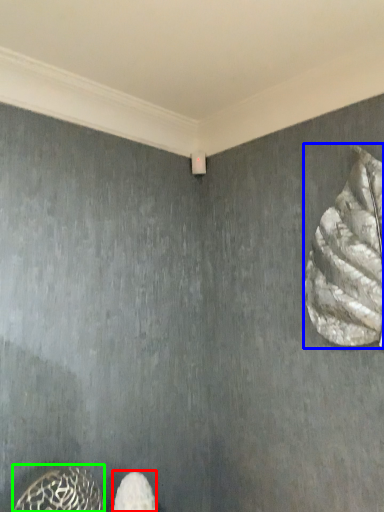
Question: Based on their relative distances, which object is nearer to footwear (highlighted by a red box)? Choose from animal (highlighted by a blue box) and animal (highlighted by a green box).

Choices:
 (A) animal
 (B) animal

Answer: (B)